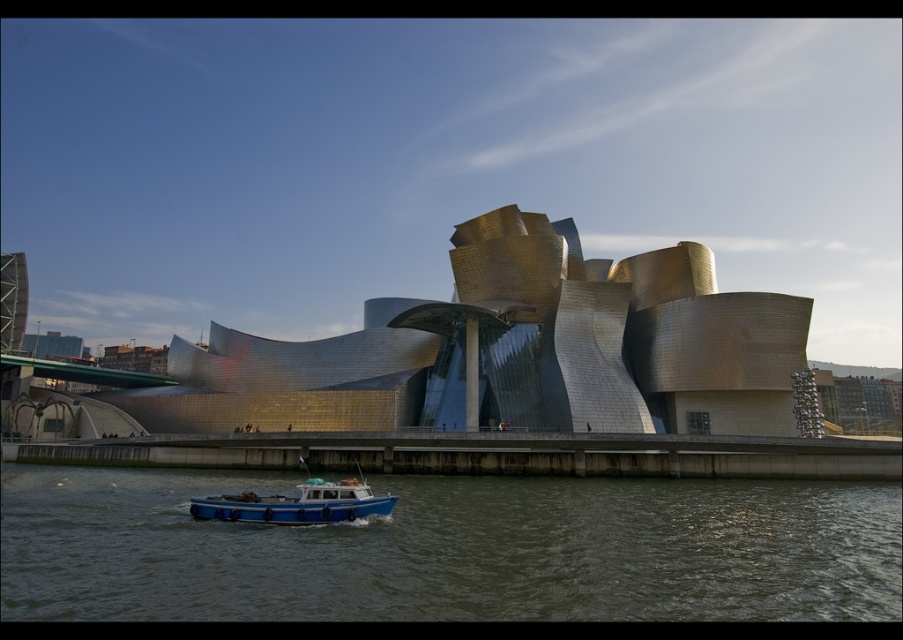
You are standing at the Guggenheim Museum Bilbao and see two points in the image. The first point is at coordinate point (812,547) and the second point is at coordinate point (360,513). Which point is closer to you?

Point (812,547) is in front of point (360,513), so it is closer to you.

You are standing in front of the Guggenheim Museum Bilbao and want to take a photo of the dark green water at lower center. Where should you position yourself to capture the water in the lower center of your camera frame?

Position yourself so that the dark green water at lower center is centered in your camera frame at the coordinates corresponding to point 0.861 on the horizontal axis and 0.501 on the vertical axis.

You are a photographer planning to capture the Guggenheim Museum Bilbao with the boat in the frame. Given the dark green water at lower center and the blue matte boat at lower center, which object occupies a larger portion of the image horizontally?

The dark green water at lower center occupies a larger portion of the image horizontally since its width surpasses that of the blue matte boat at lower center.